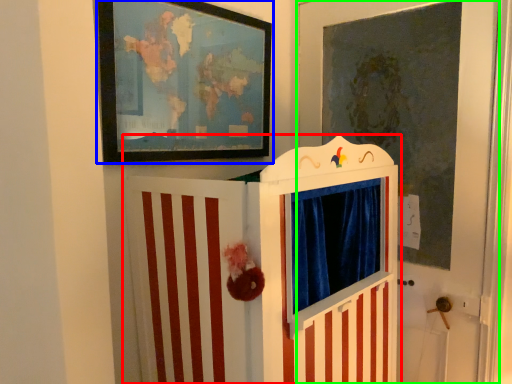
Question: Considering the real-world distances, which object is farthest from furniture (highlighted by a red box)? picture frame (highlighted by a blue box) or door (highlighted by a green box)?

Choices:
 (A) picture frame
 (B) door

Answer: (B)